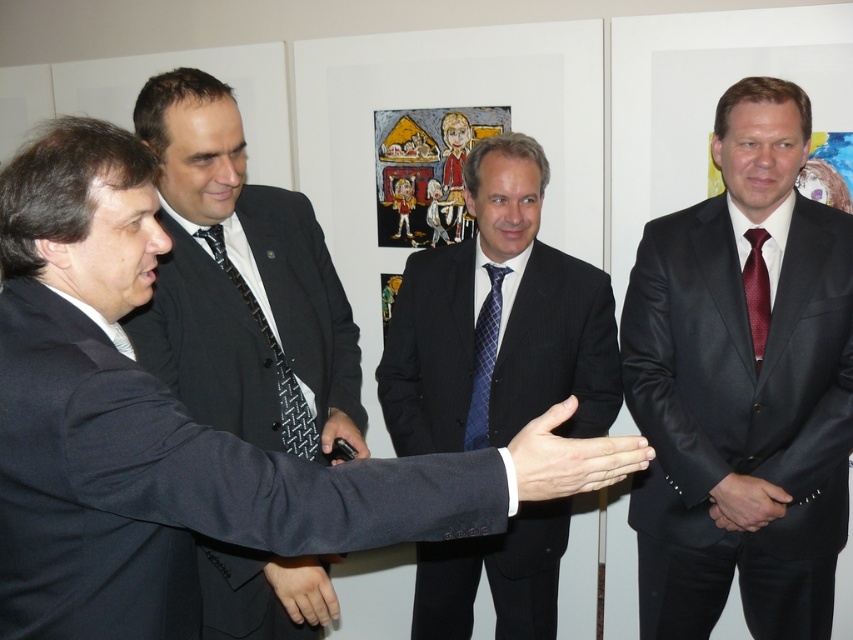
Does shiny black suit at right appear under white matte hand at center?

No.

Measure the distance between shiny black suit at right and camera.

shiny black suit at right and camera are 5.74 feet apart.

The width and height of the screenshot is (853, 640). Identify the location of shiny black suit at right. (741, 384).

Does black textured suit at left appear on the left side of pinstriped suit at center?

Indeed, black textured suit at left is positioned on the left side of pinstriped suit at center.

Where is `black textured suit at left`? black textured suit at left is located at coordinates (239, 282).

Who is taller, smooth skin hand at center or black leather hand at center?

With more height is smooth skin hand at center.

Between point (326, 557) and point (738, 480), which one is positioned in front?

Positioned in front is point (326, 557).

Is point (300, 572) less distant than point (784, 490)?

Yes, point (300, 572) is in front of point (784, 490).

Locate an element on the screen. The height and width of the screenshot is (640, 853). smooth skin hand at center is located at coordinates (302, 589).